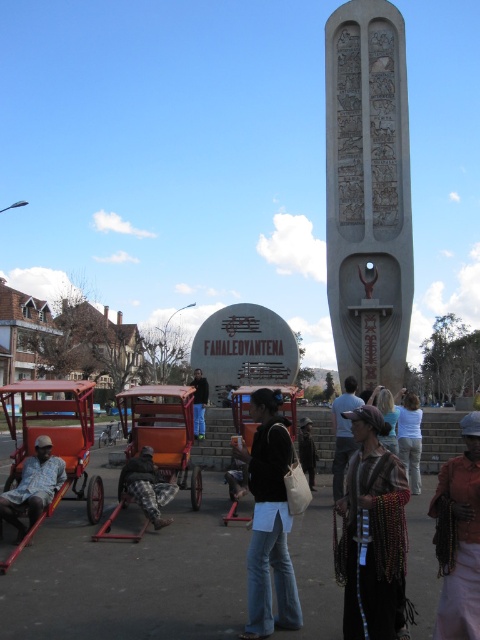
You are a photographer planning to take a photo of the monument. You notice two people wearing denim jeans at center and camouflage pants at center are standing in the scene. To ensure both are visible in the photo, which clothing item should be positioned closer to the camera?

The denim jeans at center is in front of camouflage pants at center, so to ensure both are visible, the denim jeans at center should be positioned closer to the camera as it is already in front.

You are a photographer trying to capture the carved stone monument at center and the dark brown leather jacket at center in a single frame. Based on their sizes, which object should you focus on first to ensure both are in the frame?

The carved stone monument at center is taller than the dark brown leather jacket at center, so you should focus on the carved stone monument at center first to ensure both are in the frame.

You are standing in front of the monument and want to move from the red wood wagon at left to the matte brown cart at center. Which direction should you move relative to the monument?

To move from the red wood wagon at left to the matte brown cart at center, you should move upward since the red wood wagon at left is located below the matte brown cart at center.